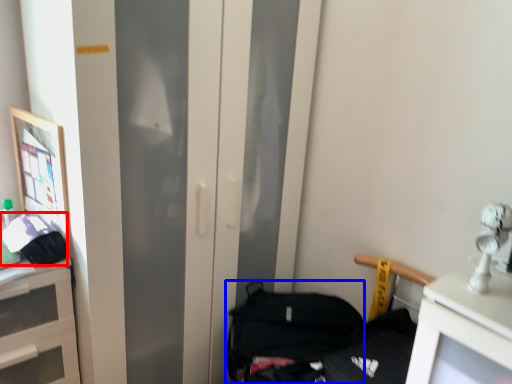
Question: Among these objects, which one is nearest to the camera, handbag (highlighted by a red box) or handbag (highlighted by a blue box)?

Choices:
 (A) handbag
 (B) handbag

Answer: (A)